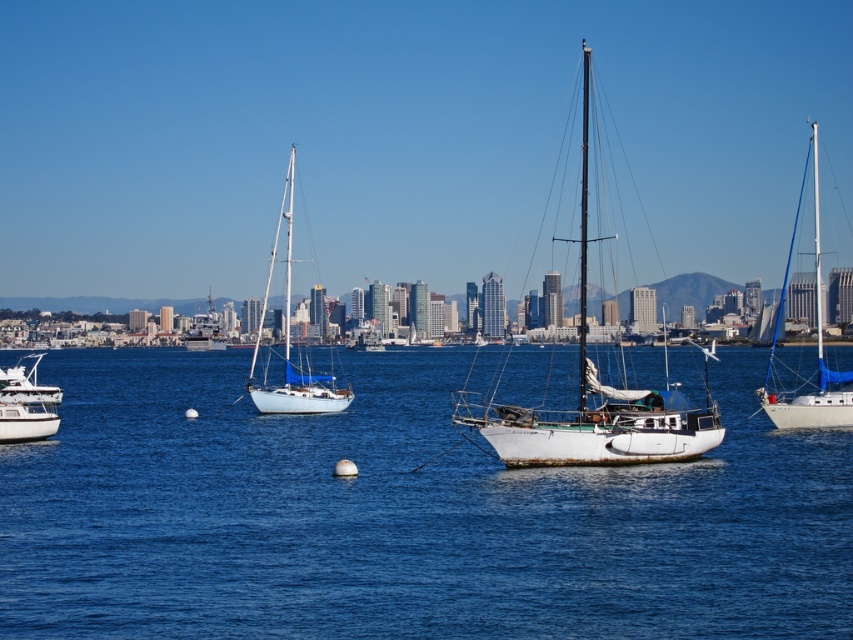
You are standing on the dock and looking at the blue water at center and the white glossy sailboat at left. Which object is positioned higher from your viewpoint?

The white glossy sailboat at left is positioned higher than the blue water at center because the blue water at center is located below it.

You are standing on the dock and see the point marked at coordinates [585,401]. What object is located at that point?

The point at coordinates [585,401] indicates the rusty metal sailboat at center.